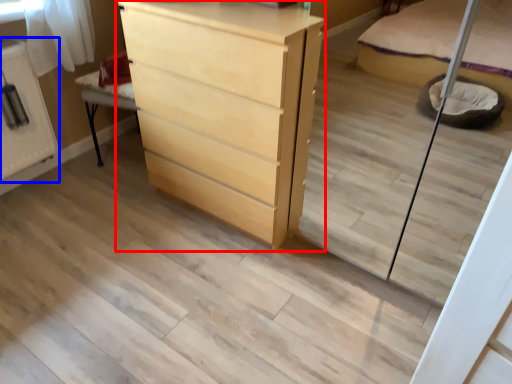
Question: Which object is further to the camera taking this photo, chest of drawers (highlighted by a red box) or cabinetry (highlighted by a blue box)?

Choices:
 (A) chest of drawers
 (B) cabinetry

Answer: (B)